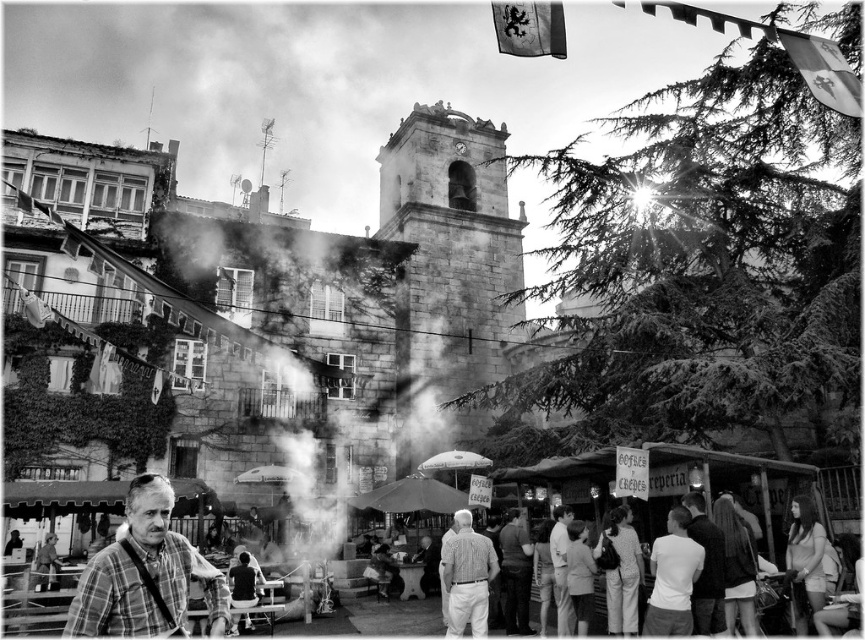
Question: Which is nearer to the plaid shirt at lower left?

Choices:
 (A) white matte umbrella at center
 (B) striped shirt at center
 (C) light gray fabric shirt at center

Answer: (B)

Question: Is striped shirt at center further to camera compared to dark gray fabric jacket at center?

Choices:
 (A) no
 (B) yes

Answer: (B)

Question: Does light gray fabric shirt at center lie behind white matte umbrella at center?

Choices:
 (A) yes
 (B) no

Answer: (B)

Question: Which point is closer to the camera?

Choices:
 (A) (490, 465)
 (B) (487, 612)
 (C) (694, 499)
 (D) (572, 627)

Answer: (C)

Question: Estimate the real-world distances between objects in this image. Which object is farther from the striped shirt at center?

Choices:
 (A) dark gray fabric jacket at center
 (B) light gray fabric shirt at center
 (C) plaid shirt at lower left

Answer: (C)

Question: From the image, what is the correct spatial relationship of dark gray fabric jacket at center in relation to white matte umbrella at center?

Choices:
 (A) above
 (B) below

Answer: (B)